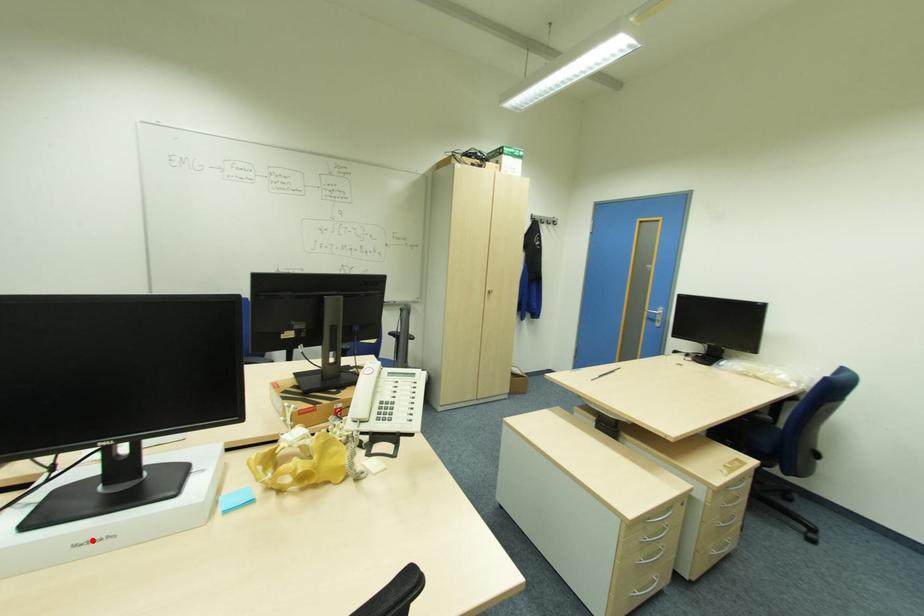
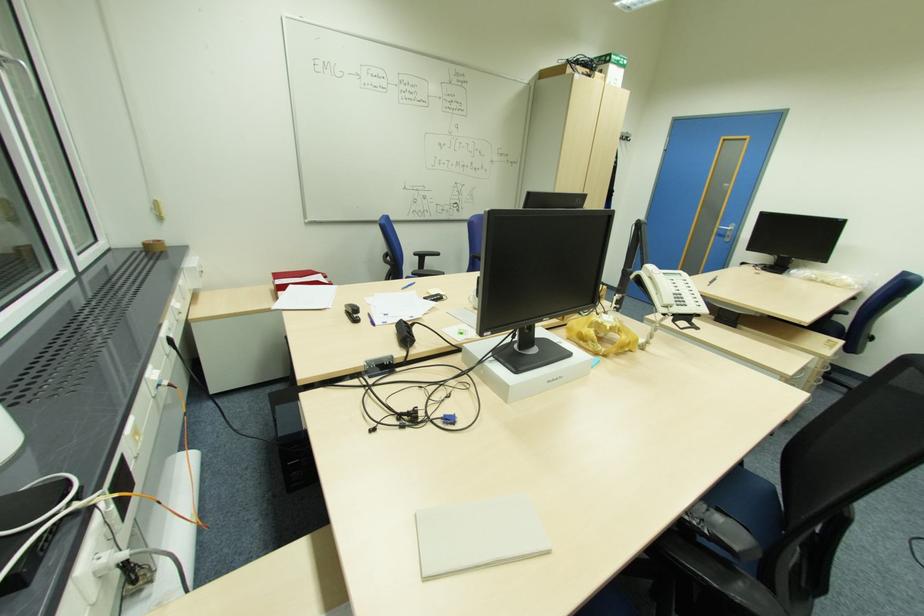
Find the pixel in the second image that matches the highlighted location in the first image.

(555, 379)